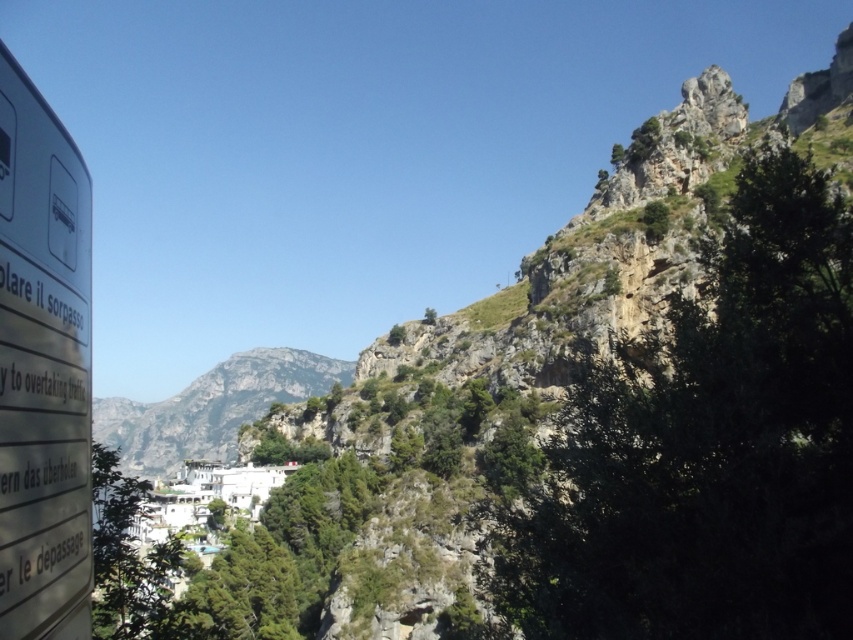
Question: Does white plastic sign at left appear on the left side of gray rocky mountain at center?

Choices:
 (A) yes
 (B) no

Answer: (B)

Question: From the image, what is the correct spatial relationship of white plastic sign at left in relation to gray rocky mountain at center?

Choices:
 (A) below
 (B) above

Answer: (B)

Question: Does white plastic sign at left have a lesser width compared to gray rocky mountain at center?

Choices:
 (A) no
 (B) yes

Answer: (B)

Question: Among these objects, which one is farthest from the camera?

Choices:
 (A) white plastic sign at left
 (B) gray rocky mountain at center

Answer: (B)

Question: Which point is farther to the camera?

Choices:
 (A) (129, 420)
 (B) (28, 173)

Answer: (A)